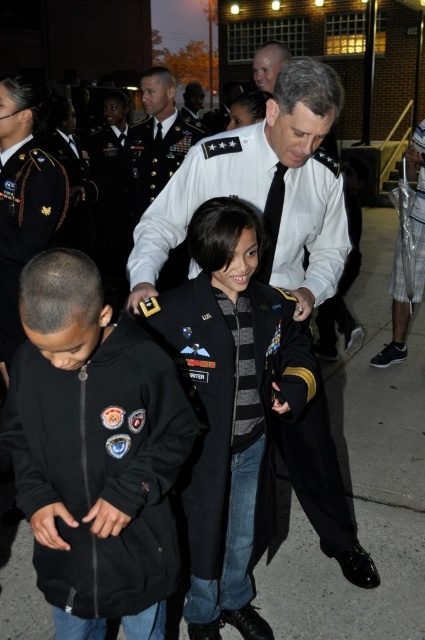
Between white uniform at center and dark green uniform at center, which one has more height?

A: With more height is dark green uniform at center.

Is white uniform at center positioned behind dark green uniform at center?

No, white uniform at center is in front of dark green uniform at center.

Locate an element on the screen. This screenshot has width=425, height=640. white uniform at center is located at coordinates (263, 192).

This screenshot has height=640, width=425. In order to click on white uniform at center in this screenshot , I will do `click(263, 192)`.

Does dark blue wool jacket at center have a larger size compared to smooth bald head at upper center?

Correct, dark blue wool jacket at center is larger in size than smooth bald head at upper center.

Who is higher up, dark blue wool jacket at center or smooth bald head at upper center?

smooth bald head at upper center is above.

Does point (261, 513) come closer to viewer compared to point (255, 54)?

Yes, point (261, 513) is closer to viewer.

Where is `dark blue wool jacket at center`? dark blue wool jacket at center is located at coordinates pyautogui.click(x=229, y=417).

Looking at this image, who is shorter, black fleece jacket at lower left or dark green uniform at center?

black fleece jacket at lower left

Is point (133, 545) more distant than point (161, 173)?

No, (133, 545) is in front of (161, 173).

Locate an element on the screen. Image resolution: width=425 pixels, height=640 pixels. black fleece jacket at lower left is located at coordinates (95, 452).